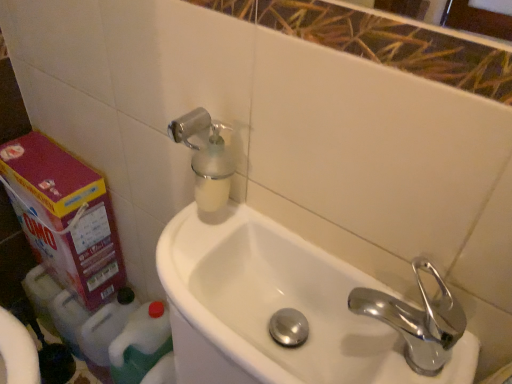
Question: Is chrome metallic faucet at right positioned in front of white glossy sink at center?

Choices:
 (A) no
 (B) yes

Answer: (A)

Question: Is chrome metallic faucet at right positioned far away from white glossy sink at center?

Choices:
 (A) yes
 (B) no

Answer: (B)

Question: Is white glossy sink at center at the back of chrome metallic faucet at right?

Choices:
 (A) yes
 (B) no

Answer: (B)

Question: Considering the relative positions of chrome metallic faucet at right and white glossy sink at center in the image provided, is chrome metallic faucet at right to the left of white glossy sink at center from the viewer's perspective?

Choices:
 (A) no
 (B) yes

Answer: (A)

Question: Are chrome metallic faucet at right and white glossy sink at center making contact?

Choices:
 (A) no
 (B) yes

Answer: (A)

Question: Relative to translucent plastic soap dispenser at upper left, is white glossy sink at center in front or behind?

Choices:
 (A) behind
 (B) front

Answer: (B)

Question: From a real-world perspective, is white glossy sink at center physically located above or below translucent plastic soap dispenser at upper left?

Choices:
 (A) below
 (B) above

Answer: (A)

Question: In terms of width, does white glossy sink at center look wider or thinner when compared to translucent plastic soap dispenser at upper left?

Choices:
 (A) wide
 (B) thin

Answer: (A)

Question: Is white glossy sink at center taller or shorter than translucent plastic soap dispenser at upper left?

Choices:
 (A) tall
 (B) short

Answer: (B)

Question: In the image, is chrome metallic faucet at right positioned in front of or behind translucent plastic soap dispenser at upper left?

Choices:
 (A) behind
 (B) front

Answer: (B)

Question: In terms of size, does chrome metallic faucet at right appear bigger or smaller than translucent plastic soap dispenser at upper left?

Choices:
 (A) big
 (B) small

Answer: (B)

Question: Considering the positions of point [411, 306] and point [224, 165], is point [411, 306] closer or farther from the camera than point [224, 165]?

Choices:
 (A) farther
 (B) closer

Answer: (B)

Question: From the image's perspective, is chrome metallic faucet at right located above or below translucent plastic soap dispenser at upper left?

Choices:
 (A) above
 (B) below

Answer: (B)

Question: In terms of width, does white glossy sink at center look wider or thinner when compared to chrome metallic faucet at right?

Choices:
 (A) wide
 (B) thin

Answer: (A)

Question: Considering the positions of white glossy sink at center and chrome metallic faucet at right in the image, is white glossy sink at center bigger or smaller than chrome metallic faucet at right?

Choices:
 (A) big
 (B) small

Answer: (A)